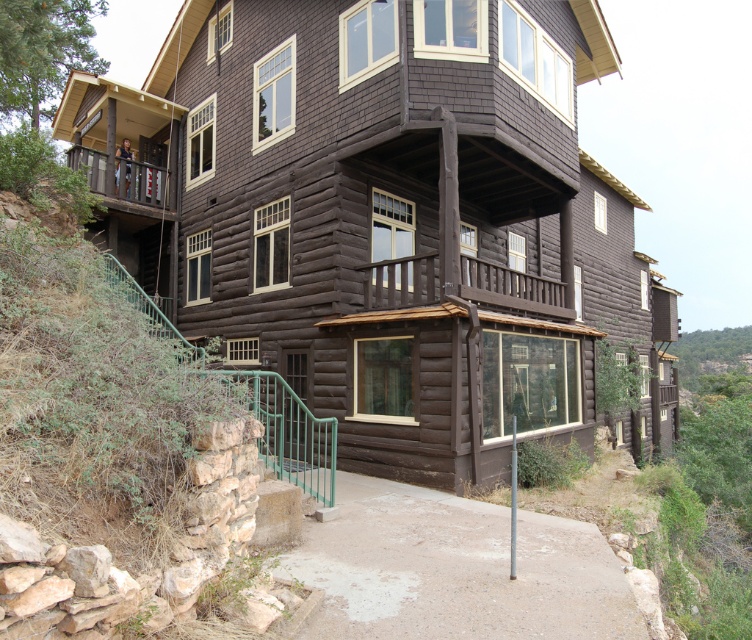
You are standing on the front porch of the dark wood cabin at center and want to go to the point marked as point [411,221]. Is this point located on the dark wood cabin at center?

Yes, the point [411,221] is on the dark wood cabin at center, so you can reach it by staying on the cabin structure.

You are standing at the entrance of the log cabin and want to locate two specific points marked in the image. The first point is at coordinate point(408, 257) and the second is at point(102, 164). From your current position, which point is closer to you?

Point(408, 257) is in front of point(102, 164), so the first point is closer to you.

You are standing at the entrance of the log cabin and want to walk towards the point marked as point (562, 289). There is another point marked as point (314, 228) in your path. Which point will you encounter first?

You will encounter point (314, 228) first because it is in front of point (562, 289) along your path.